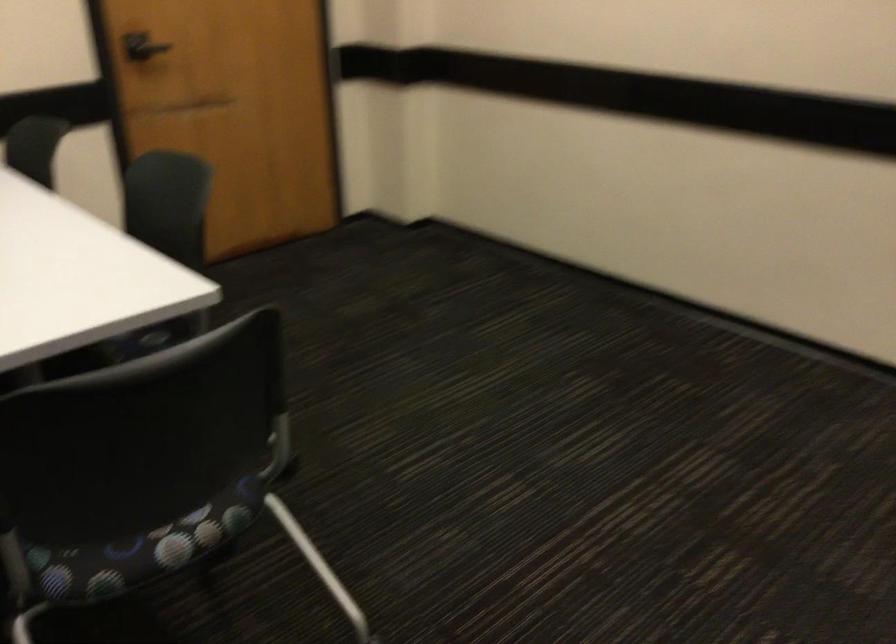
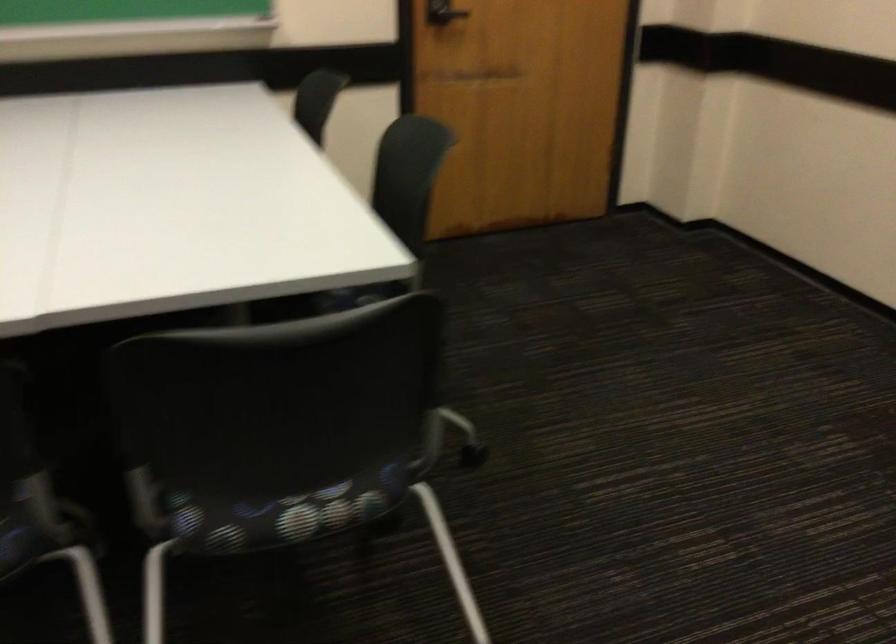
Where in the second image is the point corresponding to point 159,544 from the first image?

(286, 514)